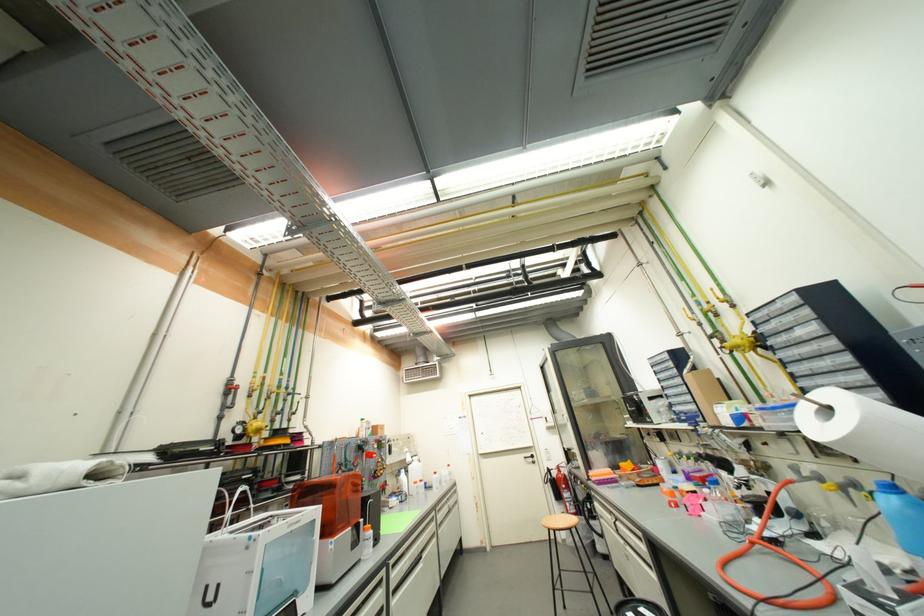
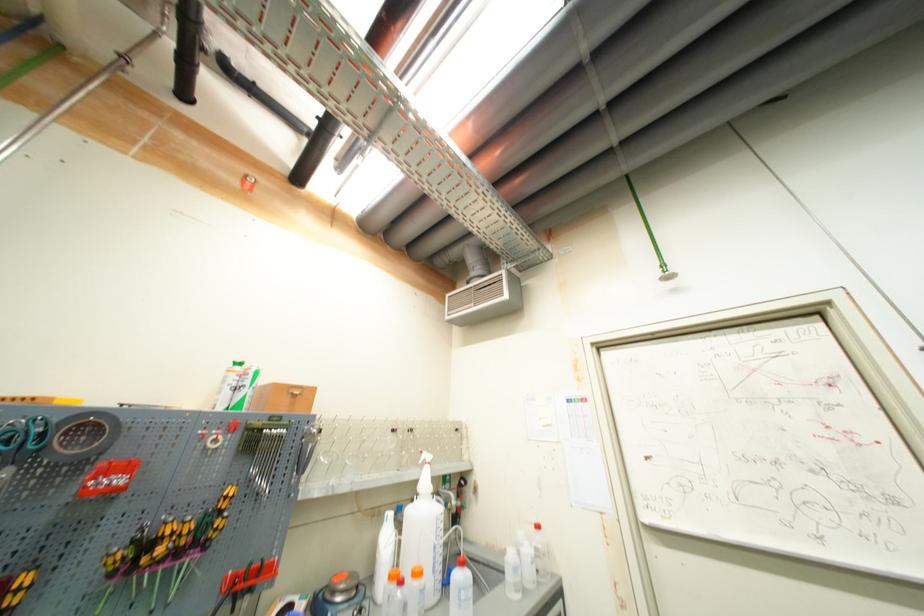
Locate, in the second image, the point that corresponds to [454,480] in the first image.

(533, 578)